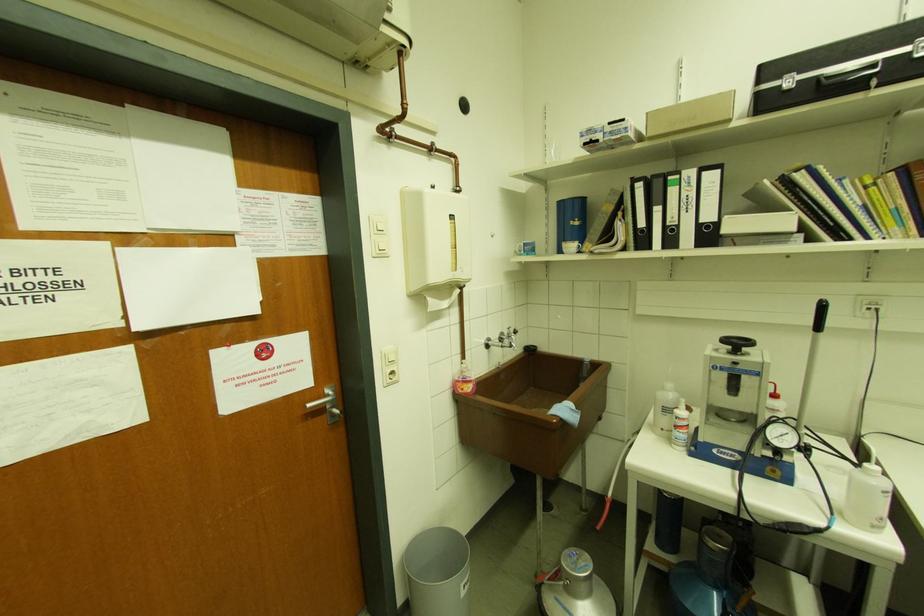
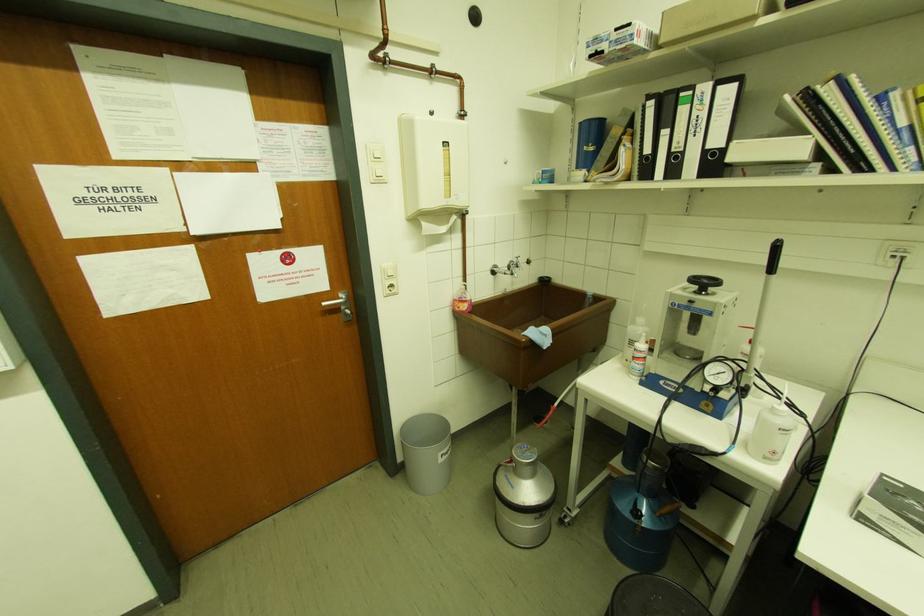
In the second image, find the point that corresponds to (387,357) in the first image.

(386, 272)